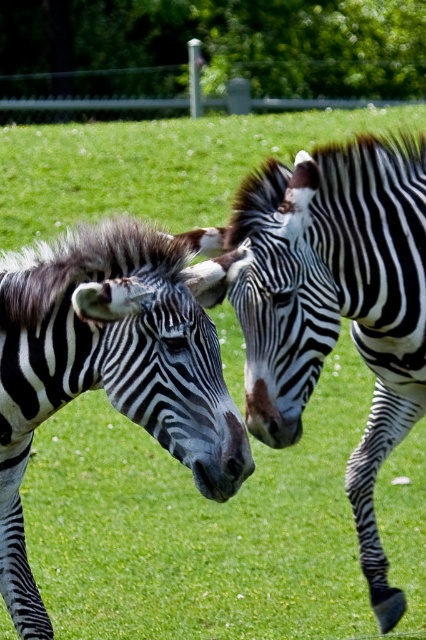
Question: Which point is farther to the camera?

Choices:
 (A) black and white striped zebra at left
 (B) black and white striped zebra at center

Answer: (B)

Question: Is black and white striped zebra at center thinner than black and white striped zebra at left?

Choices:
 (A) no
 (B) yes

Answer: (A)

Question: Where is black and white striped zebra at center located in relation to black and white striped zebra at left in the image?

Choices:
 (A) right
 (B) left

Answer: (A)

Question: Which object appears farthest from the camera in this image?

Choices:
 (A) black and white striped zebra at left
 (B) black and white striped zebra at center

Answer: (B)

Question: In this image, where is black and white striped zebra at center located relative to black and white striped zebra at left?

Choices:
 (A) left
 (B) right

Answer: (B)

Question: Which of the following is the closest to the observer?

Choices:
 (A) (204, 330)
 (B) (327, 264)

Answer: (A)